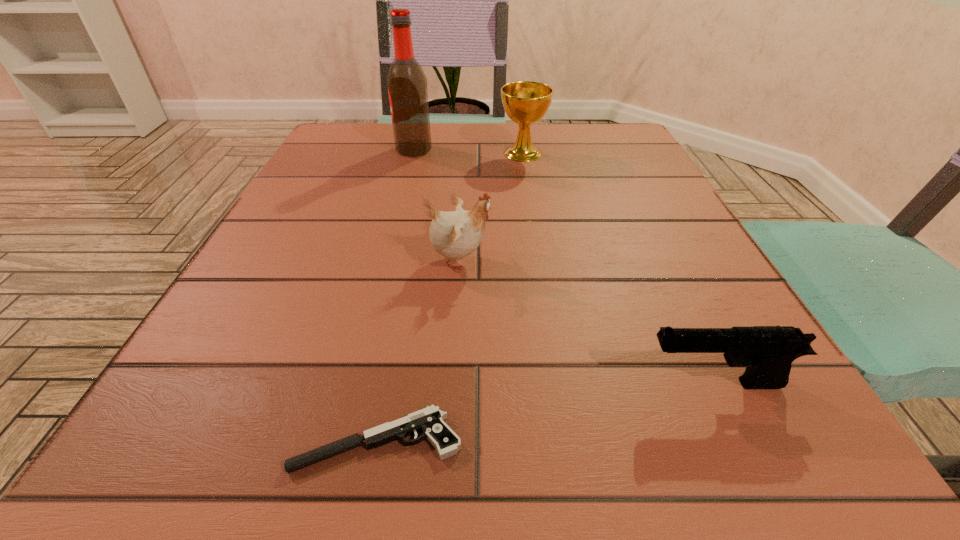
Locate an element on the screen. The height and width of the screenshot is (540, 960). vacant space located 0.210m on the front-facing side of the right pistol is located at coordinates (470, 383).

At what (x,y) coordinates should I click in order to perform the action: click on blank space located on the front-facing side of the right pistol. Please return your answer as a coordinate pair (x, y). The height and width of the screenshot is (540, 960). Looking at the image, I should click on (544, 383).

The width and height of the screenshot is (960, 540). I want to click on free region located on the front-facing side of the right pistol, so click(x=561, y=383).

In order to click on vacant space located 0.060m on the front-facing side of the left pistol in this screenshot , I will do `click(241, 441)`.

You are a GUI agent. You are given a task and a screenshot of the screen. Output one action in this format:
    pyautogui.click(x=<x>, y=<y>)
    Task: Click on the vacant point located on the front-facing side of the left pistol
    This screenshot has width=960, height=540.
    Given the screenshot: What is the action you would take?
    pyautogui.click(x=223, y=441)

Where is `vacant space located 0.110m on the front-facing side of the left pistol`? vacant space located 0.110m on the front-facing side of the left pistol is located at coordinates point(195,441).

This screenshot has height=540, width=960. I want to click on beer bottle positioned at the far edge, so click(x=407, y=84).

The height and width of the screenshot is (540, 960). Find the location of `chalice that is at the far edge`. chalice that is at the far edge is located at coordinates (525, 102).

Find the location of a particular element. The width and height of the screenshot is (960, 540). object that is positioned at the near edge is located at coordinates (429, 420).

At what (x,y) coordinates should I click in order to perform the action: click on object that is at the right edge. Please return your answer as a coordinate pair (x, y). This screenshot has width=960, height=540. Looking at the image, I should click on (767, 352).